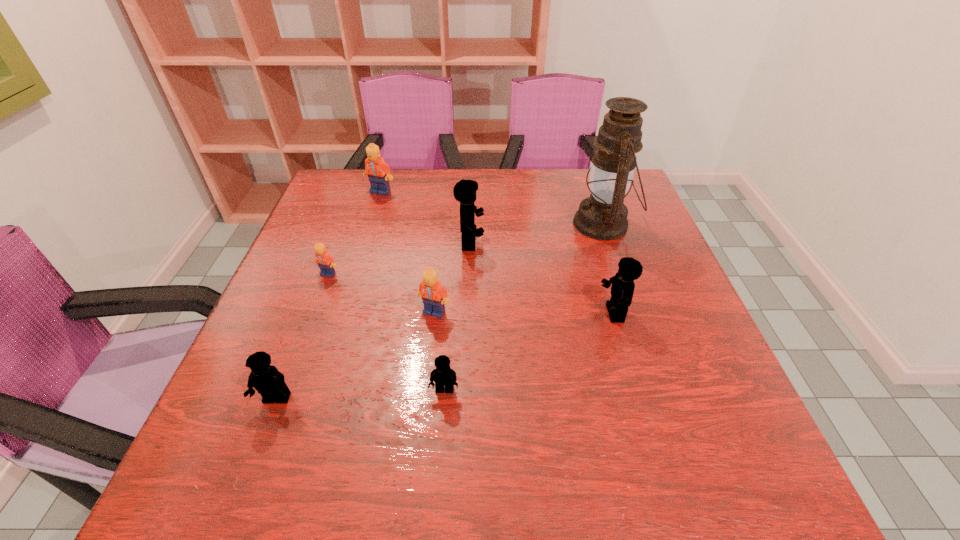
The width and height of the screenshot is (960, 540). I want to click on vacant space at the near edge of the desktop, so click(x=442, y=489).

The image size is (960, 540). Identify the location of free location at the left edge. (335, 256).

Identify the location of vacant space at the right edge of the desktop. The image size is (960, 540). (610, 276).

Find the location of `vacant region at the far left corner`. vacant region at the far left corner is located at coordinates (321, 201).

Locate an element on the screen. free space at the near left corner of the desktop is located at coordinates (195, 503).

Locate an element on the screen. This screenshot has width=960, height=540. free space between the smallest yellow Lego and the farthest orange Lego is located at coordinates (413, 291).

Locate an element on the screen. The image size is (960, 540). vacant space that's between the oil lamp and the biggest orange Lego is located at coordinates (492, 208).

Identify the location of vacant area that lies between the smallest yellow Lego and the nearest orange Lego. The image size is (960, 540). (440, 351).

Identify the location of free spot between the smallest orange Lego and the rightmost yellow Lego. (470, 293).

Locate an element on the screen. This screenshot has height=540, width=960. free space between the rightmost yellow Lego and the second biggest orange Lego is located at coordinates (524, 312).